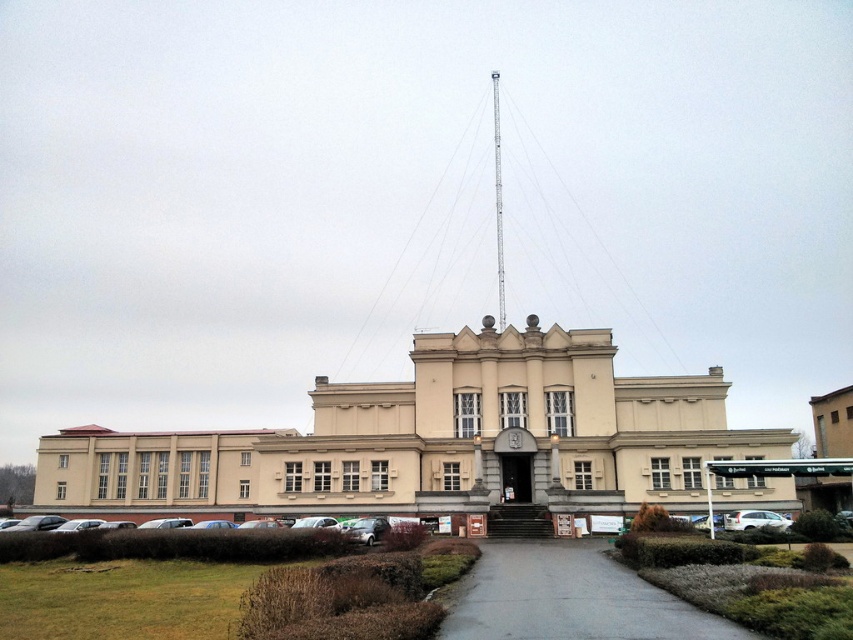
Is beige stone building at center behind gray asphalt path at center?

Yes, beige stone building at center is further from the viewer.

From the picture: Measure the distance between beige stone building at center and gray asphalt path at center.

beige stone building at center is 37.12 meters from gray asphalt path at center.

Which is in front, point (454, 460) or point (479, 636)?

Point (479, 636)

Image resolution: width=853 pixels, height=640 pixels. Find the location of `beige stone building at center`. beige stone building at center is located at coordinates (440, 442).